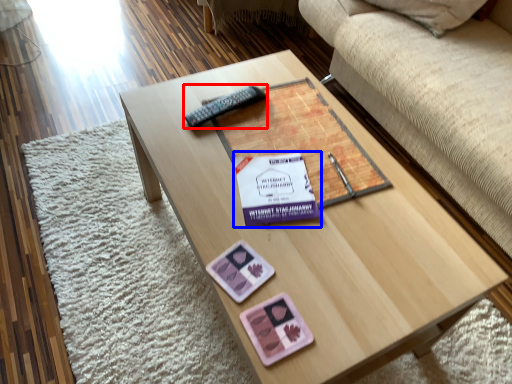
Question: Which object appears farthest to the camera in this image, remote (highlighted by a red box) or paperback book (highlighted by a blue box)?

Choices:
 (A) remote
 (B) paperback book

Answer: (A)